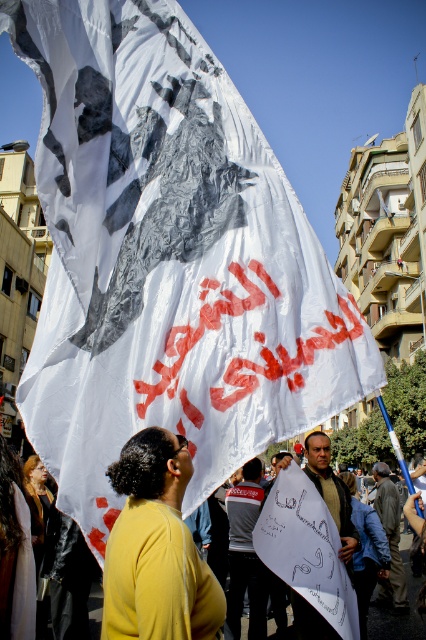
You are a photographer trying to capture the white banner in the background. You notice the yellow matte shirt at center and the dark gray fabric at center might block your view. Which object should you move to ensure the banner is visible?

The yellow matte shirt at center is in front of the dark gray fabric at center, so you should move the yellow matte shirt at center to ensure the banner is visible.

You are a photographer trying to capture the white banner with the black and white graphic. You are standing at the position of the yellow matte shirt at center. Which direction should you move to get a better view of the banner?

Since the yellow matte shirt at center is located at point 0.858 on the x axis and 0.366 on the y axis, moving towards the center of the image would provide a better view of the banner.

You are a photographer standing at the edge of the protest, wanting to capture a photo of the yellow matte shirt at center and dark brown leather jacket at center in the same frame. Your camera has a maximum focal length that allows capturing objects within 10 meters. Can you include both subjects in one shot?

The distance between the yellow matte shirt at center and dark brown leather jacket at center is 15.03 meters, which exceeds the camera maximum focal length of 10 meters. Therefore, you cannot include both subjects in one shot.